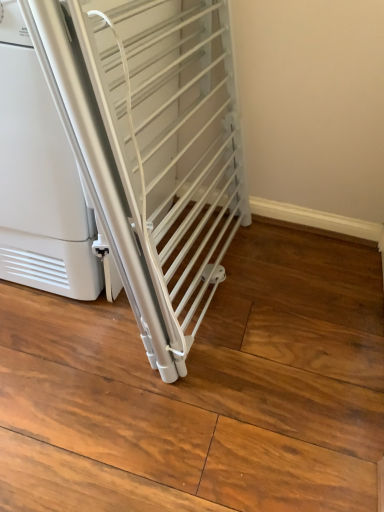
Where is `white plastic refrigerator at left`? This screenshot has width=384, height=512. white plastic refrigerator at left is located at coordinates (39, 179).

Measure the distance between white plastic refrigerator at left and camera.

A distance of 28.75 inches exists between white plastic refrigerator at left and camera.

What do you see at coordinates (39, 179) in the screenshot? The width and height of the screenshot is (384, 512). I see `white plastic refrigerator at left` at bounding box center [39, 179].

Locate an element on the screen. This screenshot has width=384, height=512. white plastic refrigerator at left is located at coordinates (39, 179).